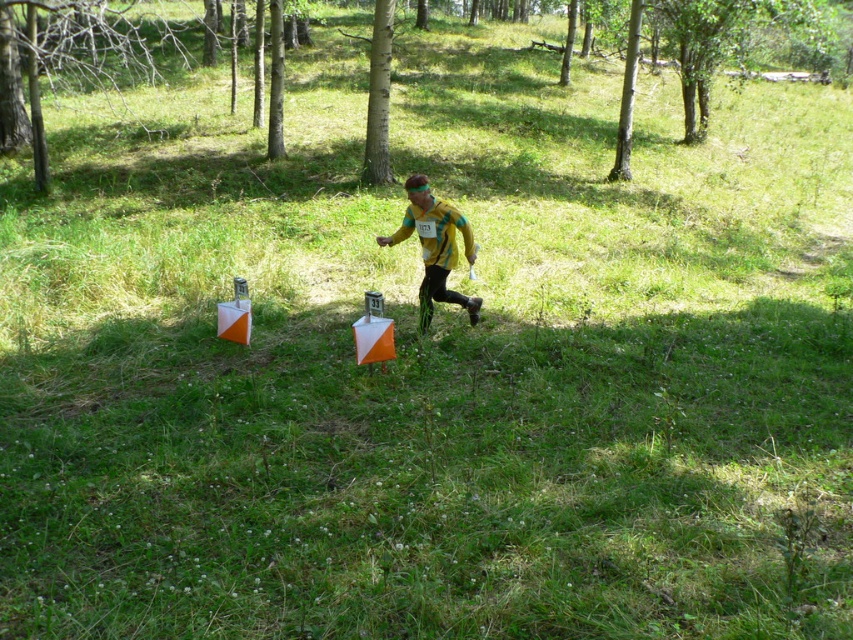
Is yellow-green fabric at center positioned behind smooth bark tree at upper right?

No, it is in front of smooth bark tree at upper right.

Is point (474, 320) positioned behind point (634, 67)?

No, it is in front of (634, 67).

Between point (432, 248) and point (635, 52), which one is positioned in front?

Point (432, 248)

Find the location of a particular element. The width and height of the screenshot is (853, 640). yellow-green fabric at center is located at coordinates (434, 248).

Which is in front, point (381, 61) or point (619, 136)?

Point (381, 61)

Is the position of smooth bark tree at center less distant than that of smooth bark tree at upper right?

That is True.

Which is behind, point (372, 29) or point (634, 35)?

The point (372, 29) is behind.

What are the coordinates of `smooth bark tree at center` in the screenshot? It's located at (378, 97).

Does green smooth tree at center have a lesser height compared to smooth bark tree at upper right?

In fact, green smooth tree at center may be taller than smooth bark tree at upper right.

Who is more distant from viewer, (175, 44) or (622, 173)?

Point (175, 44)

Locate an element on the screen. green smooth tree at center is located at coordinates (86, 65).